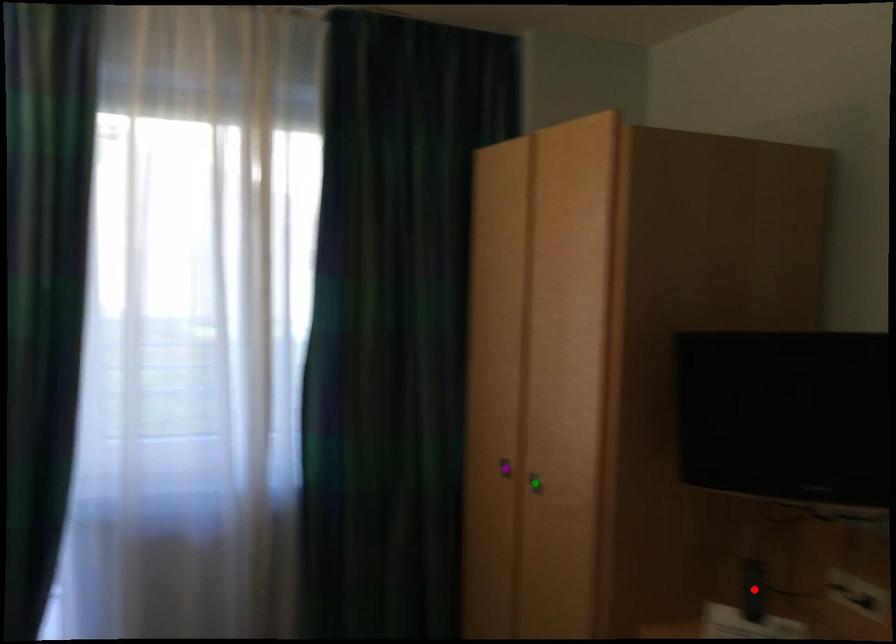
Order these from nearest to farthest:
purple point, green point, red point

red point
green point
purple point